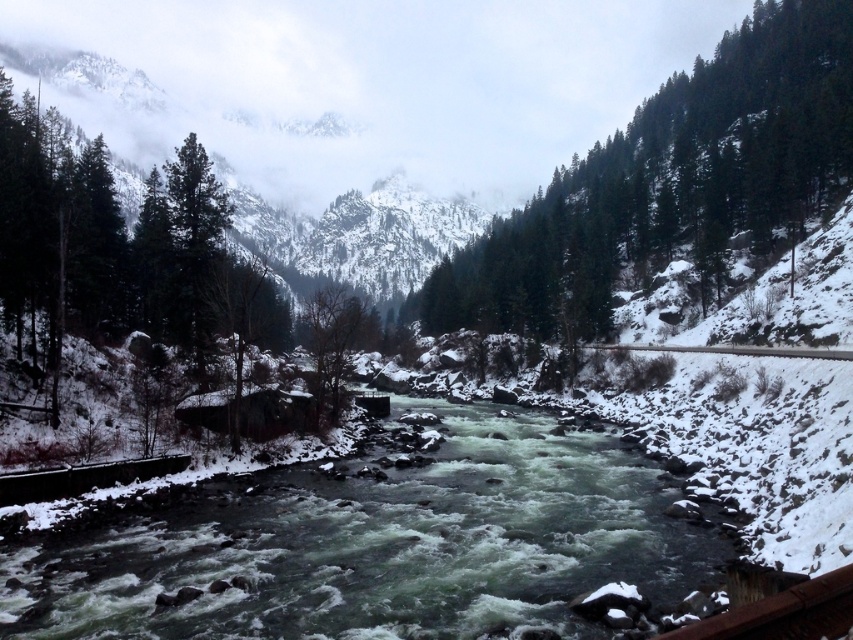
Question: Can you confirm if white frothy water at center is wider than green matte tree at center?

Choices:
 (A) yes
 (B) no

Answer: (A)

Question: Does green textured tree at upper right appear over green matte tree at center?

Choices:
 (A) no
 (B) yes

Answer: (B)

Question: Estimate the real-world distances between objects in this image. Which object is farther from the white frothy water at center?

Choices:
 (A) green matte tree at center
 (B) snowy rocky mountain at upper center
 (C) green textured tree at upper right

Answer: (B)

Question: Considering the real-world distances, which object is farthest from the green matte tree at center?

Choices:
 (A) snowy rocky mountain at upper center
 (B) white frothy water at center

Answer: (A)

Question: Among these points, which one is nearest to the camera?

Choices:
 (A) (599, 500)
 (B) (115, 166)
 (C) (746, 188)

Answer: (A)

Question: Can you confirm if white frothy water at center is smaller than green matte tree at center?

Choices:
 (A) no
 (B) yes

Answer: (B)